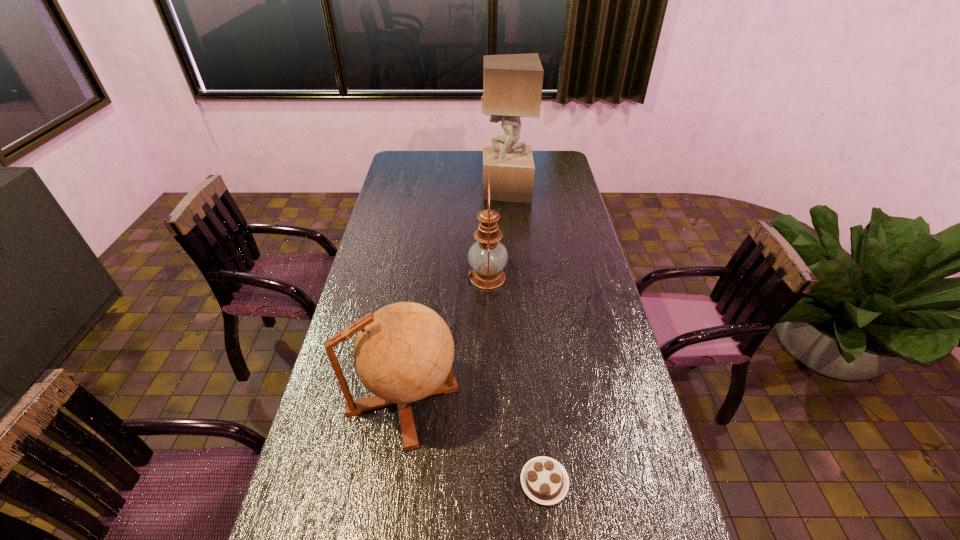
Where is `the tallest object`? This screenshot has width=960, height=540. the tallest object is located at coordinates (512, 83).

The height and width of the screenshot is (540, 960). Find the location of `sculpture`. sculpture is located at coordinates (512, 83).

The image size is (960, 540). Find the location of `the second farthest object`. the second farthest object is located at coordinates (487, 256).

Identify the location of the leftmost object. This screenshot has height=540, width=960. (404, 352).

Where is `the third farthest object`? the third farthest object is located at coordinates click(404, 352).

The height and width of the screenshot is (540, 960). In order to click on the nearest object in this screenshot , I will do `click(544, 480)`.

Locate an element on the screen. the shortest object is located at coordinates (544, 480).

The image size is (960, 540). Find the location of `free region located 0.150m on the front-facing side of the sculpture`. free region located 0.150m on the front-facing side of the sculpture is located at coordinates (448, 190).

The width and height of the screenshot is (960, 540). What are the coordinates of `vacant space located 0.080m on the front-facing side of the sculpture` in the screenshot? It's located at (464, 190).

Find the location of a particular element. The image size is (960, 540). vacant area situated on the front-facing side of the sculpture is located at coordinates (395, 190).